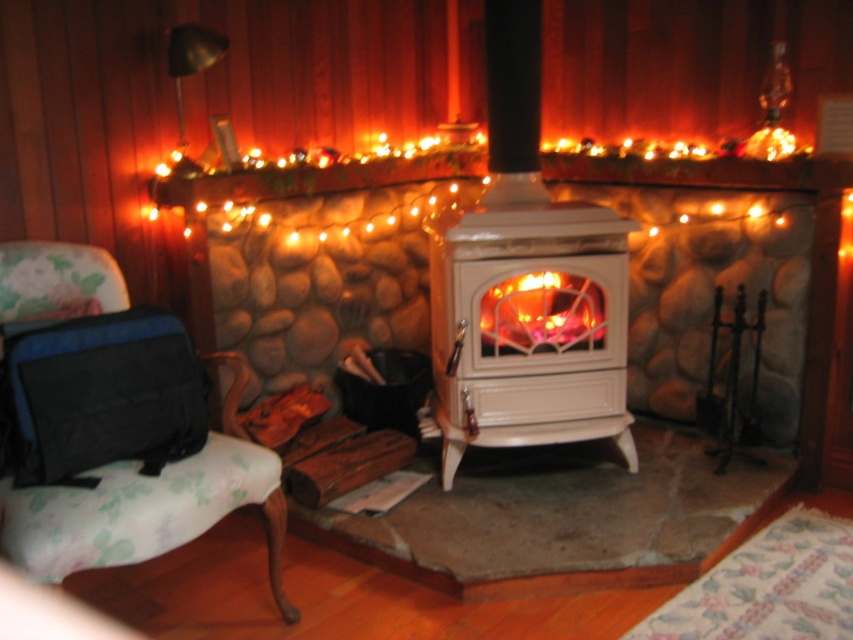
Between white glossy wood-burning stove at center and floral fabric armchair at left, which one has less height?

floral fabric armchair at left is shorter.

Can you confirm if white glossy wood-burning stove at center is positioned to the right of floral fabric armchair at left?

Indeed, white glossy wood-burning stove at center is positioned on the right side of floral fabric armchair at left.

Is point (467, 362) closer to viewer compared to point (264, 460)?

No, it is behind (264, 460).

Image resolution: width=853 pixels, height=640 pixels. Find the location of `white glossy wood-burning stove at center`. white glossy wood-burning stove at center is located at coordinates (529, 326).

Can you confirm if floral fabric armchair at left is thinner than orange glowing wood at center?

In fact, floral fabric armchair at left might be wider than orange glowing wood at center.

In the scene shown: Is floral fabric armchair at left above orange glowing wood at center?

Actually, floral fabric armchair at left is below orange glowing wood at center.

Identify the location of floral fabric armchair at left. (57, 280).

Find the location of a particular element. floral fabric armchair at left is located at coordinates (57, 280).

Is white glossy wood-burning stove at center to the right of orange glowing wood at center from the viewer's perspective?

In fact, white glossy wood-burning stove at center is to the left of orange glowing wood at center.

Is white glossy wood-burning stove at center positioned in front of orange glowing wood at center?

Yes, it is in front of orange glowing wood at center.

Does point (483, 266) lie in front of point (560, 328)?

Yes, it is.

Identify the location of white glossy wood-burning stove at center. The width and height of the screenshot is (853, 640). (529, 326).